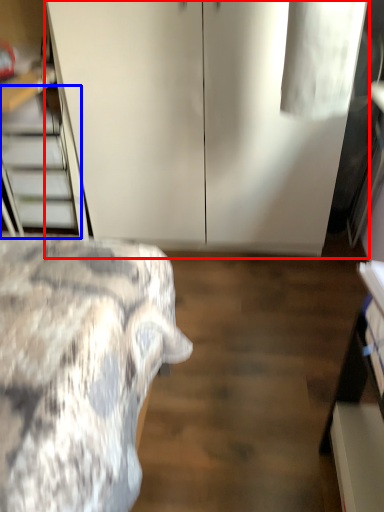
Question: Which point is further to the camera, dresser (highlighted by a red box) or stairwell (highlighted by a blue box)?

Choices:
 (A) dresser
 (B) stairwell

Answer: (B)